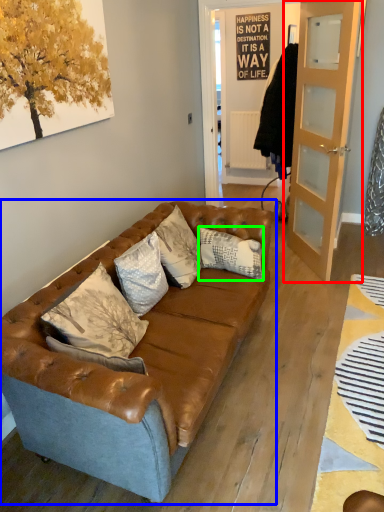
Question: Estimate the real-world distances between objects in this image. Which object is closer to door (highlighted by a red box), studio couch (highlighted by a blue box) or pillow (highlighted by a green box)?

Choices:
 (A) studio couch
 (B) pillow

Answer: (B)